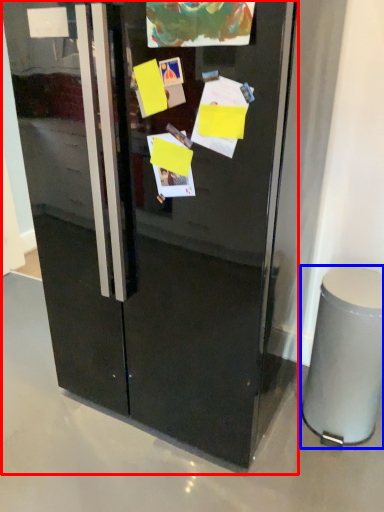
Question: Which point is closer to the camera, refrigerator (highlighted by a red box) or trash bin/can (highlighted by a blue box)?

Choices:
 (A) refrigerator
 (B) trash bin/can

Answer: (A)